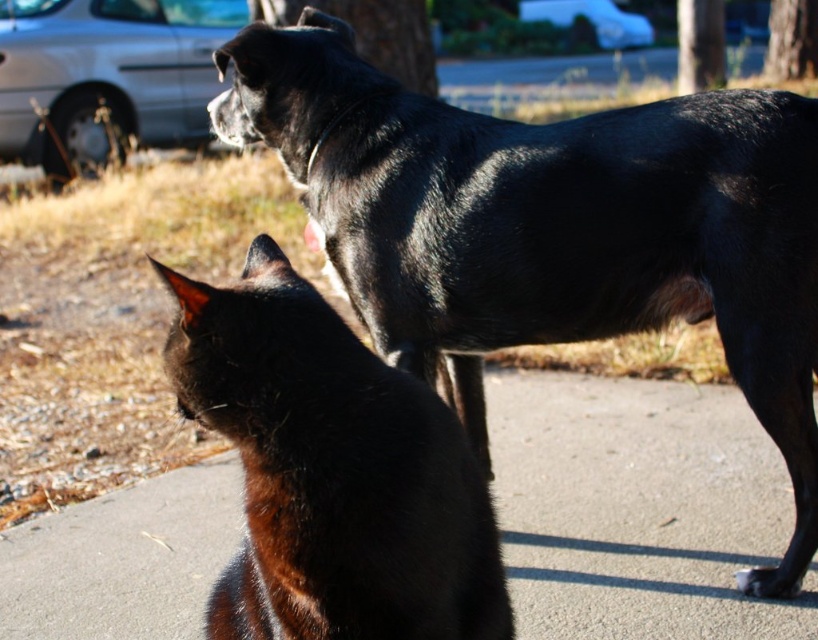
Between black shiny fur dog at center and black fur paw at lower right, which one has more height?

Standing taller between the two is black shiny fur dog at center.

Which is above, black shiny fur dog at center or black fur paw at lower right?

black shiny fur dog at center is above.

Between point (713, 179) and point (766, 588), which one is positioned behind?

The point (766, 588) is behind.

Where is `black shiny fur dog at center`? black shiny fur dog at center is located at coordinates (549, 224).

Does shiny black cat at center appear on the right side of silver metallic car at upper left?

Correct, you'll find shiny black cat at center to the right of silver metallic car at upper left.

Which is behind, point (276, 374) or point (120, 97)?

Positioned behind is point (120, 97).

At what (x,y) coordinates should I click in order to perform the action: click on shiny black cat at center. Please return your answer as a coordinate pair (x, y). The height and width of the screenshot is (640, 818). Looking at the image, I should click on (331, 472).

Can you confirm if black shiny fur dog at center is taller than shiny black cat at center?

Correct, black shiny fur dog at center is much taller as shiny black cat at center.

Does black shiny fur dog at center have a lesser height compared to shiny black cat at center?

No, black shiny fur dog at center is not shorter than shiny black cat at center.

Is point (766, 292) positioned after point (335, 529)?

That is True.

At what (x,y) coordinates should I click in order to perform the action: click on black shiny fur dog at center. Please return your answer as a coordinate pair (x, y). This screenshot has height=640, width=818. Looking at the image, I should click on (549, 224).